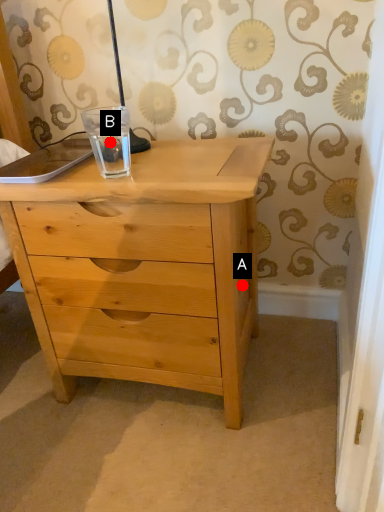
Question: Two points are circled on the image, labeled by A and B beside each circle. Which point appears closest to the camera in this image?

Choices:
 (A) A is closer
 (B) B is closer

Answer: (B)